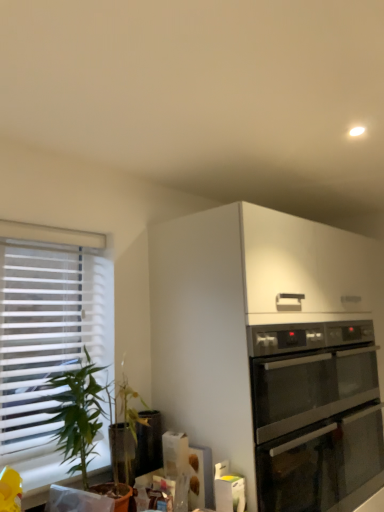
Question: Is stainless steel oven at lower right situated inside satin silver oven at upper right or outside?

Choices:
 (A) outside
 (B) inside

Answer: (A)

Question: From the image's perspective, is stainless steel oven at lower right positioned above or below satin silver oven at upper right?

Choices:
 (A) above
 (B) below

Answer: (A)

Question: Estimate the real-world distances between objects in this image. Which object is farther from the stainless steel oven at lower right?

Choices:
 (A) green leafy plant at left
 (B) satin silver oven at upper right
 (C) white blinds at left

Answer: (A)

Question: Which of these objects is positioned closest to the stainless steel oven at lower right?

Choices:
 (A) satin silver oven at upper right
 (B) green leafy plant at left
 (C) white blinds at left

Answer: (A)